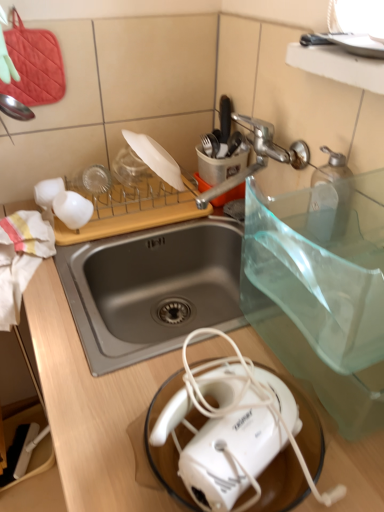
The width and height of the screenshot is (384, 512). What are the coordinates of `white plastic toaster at lower center` in the screenshot? It's located at (229, 426).

I want to click on white wood cutting board at upper center, so coord(132,216).

Where is `white matte coffee cup at upper left`? The height and width of the screenshot is (512, 384). white matte coffee cup at upper left is located at coordinates (72, 209).

Can you tell me how much white matte coffee cup at upper left and silver metallic faucet at upper center differ in facing direction?

The angle between the facing direction of white matte coffee cup at upper left and the facing direction of silver metallic faucet at upper center is 89 degrees.

Is white matte coffee cup at upper left turned away from silver metallic faucet at upper center?

No, white matte coffee cup at upper left is not facing away from silver metallic faucet at upper center.

Considering the relative positions of white matte coffee cup at upper left and silver metallic faucet at upper center in the image provided, is white matte coffee cup at upper left to the left of silver metallic faucet at upper center from the viewer's perspective?

Yes.

Considering the positions of point (194, 495) and point (247, 119), is point (194, 495) closer or farther from the camera than point (247, 119)?

Point (194, 495) appears to be closer to the viewer than point (247, 119).

Is white plastic toaster at lower center positioned far away from silver metallic faucet at upper center?

No, white plastic toaster at lower center is in close proximity to silver metallic faucet at upper center.

Between white plastic toaster at lower center and silver metallic faucet at upper center, which one is positioned in front?

white plastic toaster at lower center is closer to the camera.

Which of these two, white wood cutting board at upper center or white matte coffee cup at upper left, is bigger?

white wood cutting board at upper center is bigger.

How much distance is there between white wood cutting board at upper center and white matte coffee cup at upper left?

white wood cutting board at upper center and white matte coffee cup at upper left are 4.49 inches apart.

Is white wood cutting board at upper center with white matte coffee cup at upper left?

white wood cutting board at upper center and white matte coffee cup at upper left are not in contact.

Between white wood cutting board at upper center and white matte coffee cup at upper left, which one is positioned in front?

white wood cutting board at upper center is closer to the camera.

From the image's perspective, is white matte coffee cup at upper left above white matte plate at upper center?

Incorrect, from the image's perspective, white matte coffee cup at upper left is lower than white matte plate at upper center.

Which is in front, point (55, 199) or point (136, 139)?

The point (55, 199) is closer.

Measure the distance from white matte coffee cup at upper left to white matte plate at upper center.

white matte coffee cup at upper left is 8.38 inches away from white matte plate at upper center.

Between white matte coffee cup at upper left and white matte plate at upper center, which one appears on the left side from the viewer's perspective?

From the viewer's perspective, white matte coffee cup at upper left appears more on the left side.

From a real-world perspective, which is physically above, white matte plate at upper center or white matte coffee cup at upper left?

white matte plate at upper center, from a real-world perspective.

Does point (178, 187) lie in front of point (71, 196)?

No, (178, 187) is further to viewer.

Is white matte plate at upper center positioned behind white matte coffee cup at upper left?

Yes, it is behind white matte coffee cup at upper left.

Can you tell me how much white matte plate at upper center and white matte coffee cup at upper left differ in facing direction?

0.794 degrees.

Locate an element on the screen. The width and height of the screenshot is (384, 512). cutting board on the left of white plastic toaster at lower center is located at coordinates (132, 216).

Looking at the image, does white plastic toaster at lower center seem bigger or smaller compared to white wood cutting board at upper center?

white plastic toaster at lower center is smaller than white wood cutting board at upper center.

Considering the relative sizes of white plastic toaster at lower center and white wood cutting board at upper center in the image provided, is white plastic toaster at lower center shorter than white wood cutting board at upper center?

Incorrect, the height of white plastic toaster at lower center does not fall short of that of white wood cutting board at upper center.

Which is in front, point (223, 385) or point (55, 217)?

Point (223, 385)

Who is shorter, white wood cutting board at upper center or white plastic toaster at lower center?

Standing shorter between the two is white wood cutting board at upper center.

Which is more to the left, white wood cutting board at upper center or white plastic toaster at lower center?

white wood cutting board at upper center is more to the left.

From the image's perspective, which is above, white wood cutting board at upper center or white plastic toaster at lower center?

white wood cutting board at upper center, from the image's perspective.

You are a GUI agent. You are given a task and a screenshot of the screen. Output one action in this format:
    pyautogui.click(x=<x>, y=<y>)
    Task: Click on the faucet lying on the right of white matte coffee cup at upper left
    The height and width of the screenshot is (512, 384).
    Given the screenshot: What is the action you would take?
    pyautogui.click(x=258, y=156)

Identify the location of toaster below the silver metallic faucet at upper center (from the image's perspective). (229, 426).

Estimate the real-world distances between objects in this image. Which object is closer to white plastic toaster at lower center, white matte coffee cup at upper left or silver metallic faucet at upper center?

silver metallic faucet at upper center is positioned closer to the anchor white plastic toaster at lower center.

Looking at the image, which one is located further to silver metallic faucet at upper center, white wood cutting board at upper center or white matte coffee cup at upper left?

white matte coffee cup at upper left is further to silver metallic faucet at upper center.

Considering their positions, is silver metallic faucet at upper center positioned further to white matte plate at upper center than white matte coffee cup at upper left?

white matte coffee cup at upper left is positioned further to the anchor white matte plate at upper center.

Considering their positions, is silver metallic faucet at upper center positioned closer to white plastic toaster at lower center than white wood cutting board at upper center?

The object closer to white plastic toaster at lower center is silver metallic faucet at upper center.

Estimate the real-world distances between objects in this image. Which object is closer to white plastic toaster at lower center, silver metallic faucet at upper center or white matte plate at upper center?

silver metallic faucet at upper center is positioned closer to the anchor white plastic toaster at lower center.

Estimate the real-world distances between objects in this image. Which object is closer to white plastic toaster at lower center, white matte coffee cup at upper left or white wood cutting board at upper center?

Based on the image, white wood cutting board at upper center appears to be nearer to white plastic toaster at lower center.

When comparing their distances from white plastic toaster at lower center, does silver metallic faucet at upper center or white matte coffee cup at upper left seem further?

Among the two, white matte coffee cup at upper left is located further to white plastic toaster at lower center.

Looking at the image, which one is located closer to white wood cutting board at upper center, white matte coffee cup at upper left or silver metallic faucet at upper center?

white matte coffee cup at upper left is positioned closer to the anchor white wood cutting board at upper center.

Identify the location of cutting board between white matte coffee cup at upper left and white matte plate at upper center. click(132, 216).

Image resolution: width=384 pixels, height=512 pixels. Identify the location of cutting board between white plastic toaster at lower center and white matte coffee cup at upper left along the z-axis. (132, 216).

You are a GUI agent. You are given a task and a screenshot of the screen. Output one action in this format:
    pyautogui.click(x=<x>, y=<y>)
    Task: Click on the faucet positioned between white plastic toaster at lower center and white matte coffee cup at upper left from near to far
    The image size is (384, 512).
    Given the screenshot: What is the action you would take?
    pyautogui.click(x=258, y=156)

Find the location of a particular element. cutting board situated between white matte coffee cup at upper left and silver metallic faucet at upper center from left to right is located at coordinates (132, 216).